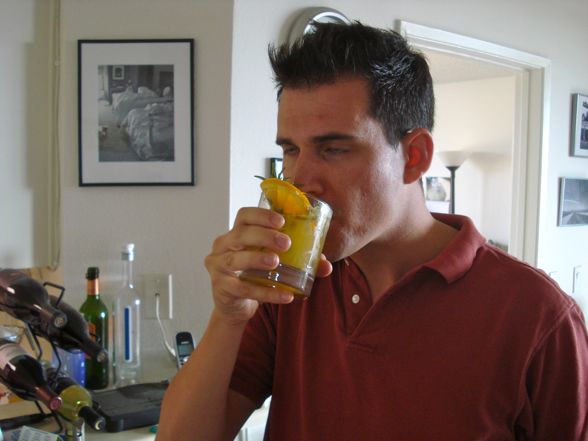
Find the location of a particular element. This screenshot has height=441, width=588. glass is located at coordinates (51, 311), (36, 388), (88, 414), (129, 326), (99, 375), (302, 235).